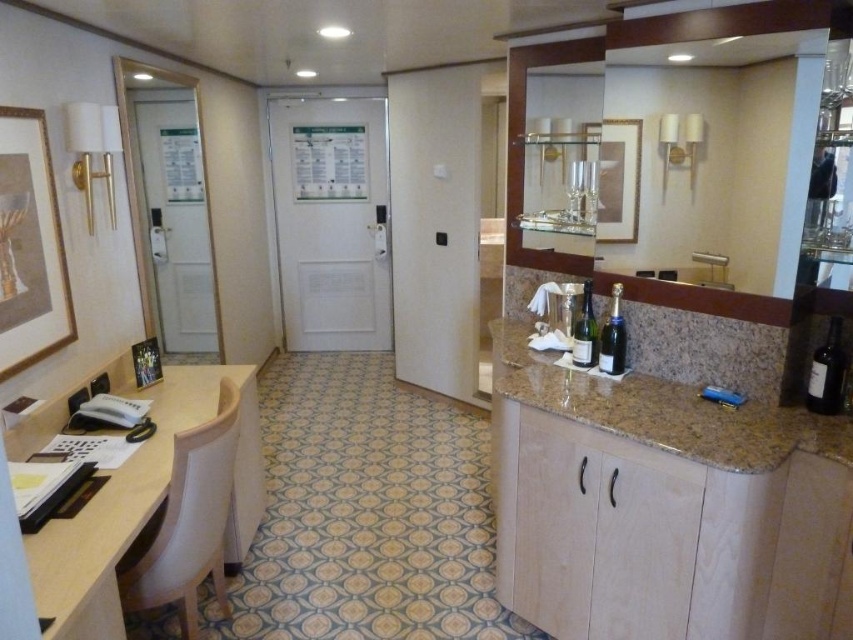
Question: Is granite countertop at right above sleek glass champagne bottle at center?

Choices:
 (A) yes
 (B) no

Answer: (B)

Question: Which point is closer to the camera taking this photo?

Choices:
 (A) (720, 99)
 (B) (114, 541)
 (C) (726, 288)

Answer: (B)

Question: Is sleek glass champagne bottle at center below silver metallic faucet at center?

Choices:
 (A) yes
 (B) no

Answer: (A)

Question: Which point appears closest to the camera in this image?

Choices:
 (A) (822, 387)
 (B) (614, 312)
 (C) (805, 42)

Answer: (C)

Question: Can you confirm if matte glass wine bottle at center is positioned above sleek glass champagne bottle at center?

Choices:
 (A) yes
 (B) no

Answer: (B)

Question: Which point is farther to the camera?

Choices:
 (A) (642, 131)
 (B) (679, 280)
 (C) (820, 349)
 (D) (624, 339)

Answer: (D)